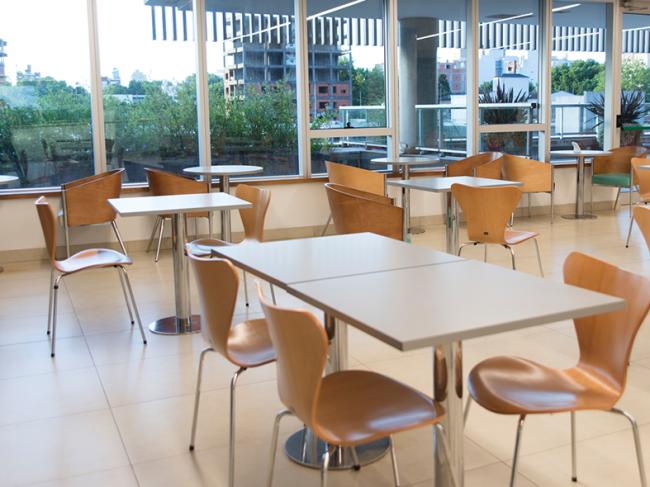
Locate an element on the screen. table legs is located at coordinates (452, 376), (340, 342), (179, 241), (225, 220), (408, 197), (450, 214), (580, 188).